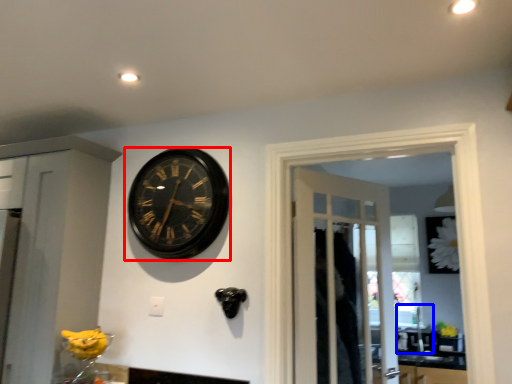
Question: Among these objects, which one is nearest to the camera, wall clock (highlighted by a red box) or sink (highlighted by a blue box)?

Choices:
 (A) wall clock
 (B) sink

Answer: (A)